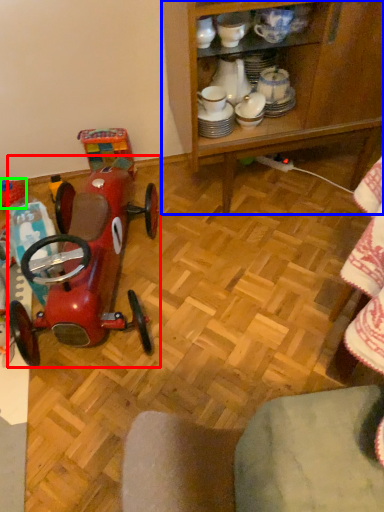
Question: Which object is positioned farthest from toy (highlighted by a red box)? Select from cabinetry (highlighted by a blue box) and toy (highlighted by a green box).

Choices:
 (A) cabinetry
 (B) toy

Answer: (A)